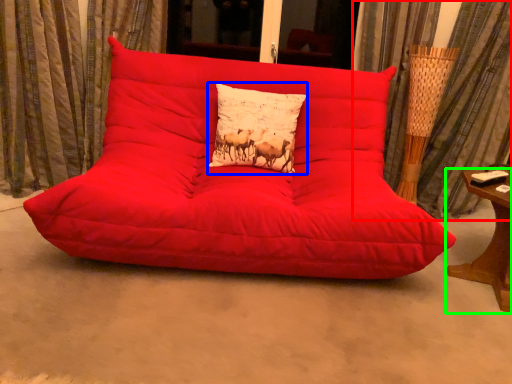
Question: Which is farther away from curtain (highlighted by a red box)? pillow (highlighted by a blue box) or table (highlighted by a green box)?

Choices:
 (A) pillow
 (B) table

Answer: (A)